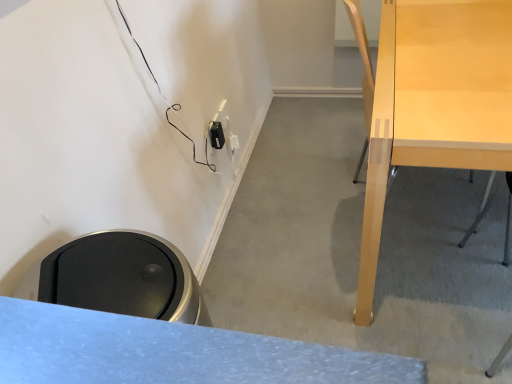
Locate an element on the screen. The width and height of the screenshot is (512, 384). black plastic electric outlet at lower center is located at coordinates (216, 135).

Measure the distance between black plastic electric outlet at lower center and camera.

The distance of black plastic electric outlet at lower center from camera is 5.33 feet.

Describe the element at coordinates (216, 135) in the screenshot. I see `black plastic electric outlet at lower center` at that location.

Image resolution: width=512 pixels, height=384 pixels. What do you see at coordinates (435, 103) in the screenshot? I see `light wood desk at right` at bounding box center [435, 103].

The image size is (512, 384). Find the location of `light wood desk at right`. light wood desk at right is located at coordinates (435, 103).

This screenshot has height=384, width=512. I want to click on black plastic electric outlet at lower center, so click(x=216, y=135).

Is black plastic electric outlet at lower center to the left of light wood desk at right from the viewer's perspective?

Yes.

Does black plastic electric outlet at lower center lie in front of light wood desk at right?

No, black plastic electric outlet at lower center is further to the viewer.

Which point is more distant from viewer, (218, 144) or (424, 57)?

The point (218, 144) is farther from the camera.

From the image's perspective, who appears lower, black plastic electric outlet at lower center or light wood desk at right?

From the image's view, light wood desk at right is below.

From a real-world perspective, who is located higher, black plastic electric outlet at lower center or light wood desk at right?

black plastic electric outlet at lower center.

Which object is wider, black plastic electric outlet at lower center or light wood desk at right?

light wood desk at right.

Which of these two, black plastic electric outlet at lower center or light wood desk at right, stands taller?

Standing taller between the two is light wood desk at right.

Considering the relative sizes of black plastic electric outlet at lower center and light wood desk at right in the image provided, is black plastic electric outlet at lower center smaller than light wood desk at right?

Indeed, black plastic electric outlet at lower center has a smaller size compared to light wood desk at right.

Can we say black plastic electric outlet at lower center lies outside light wood desk at right?

Absolutely, black plastic electric outlet at lower center is external to light wood desk at right.

From the picture: Is black plastic electric outlet at lower center positioned far away from light wood desk at right?

No, there isn't a large distance between black plastic electric outlet at lower center and light wood desk at right.

Is black plastic electric outlet at lower center oriented away from light wood desk at right?

black plastic electric outlet at lower center does not have its back to light wood desk at right.

Can you tell me how much black plastic electric outlet at lower center and light wood desk at right differ in facing direction?

The facing directions of black plastic electric outlet at lower center and light wood desk at right are 87.9 degrees apart.

At what (x,y) coordinates should I click in order to perform the action: click on desk to the right of black plastic electric outlet at lower center. Please return your answer as a coordinate pair (x, y). This screenshot has width=512, height=384. Looking at the image, I should click on (435, 103).

Is light wood desk at right to the right of black plastic electric outlet at lower center from the viewer's perspective?

Indeed, light wood desk at right is positioned on the right side of black plastic electric outlet at lower center.

Is light wood desk at right in front of or behind black plastic electric outlet at lower center in the image?

Visually, light wood desk at right is located in front of black plastic electric outlet at lower center.

Between point (486, 130) and point (217, 128), which one is positioned in front?

Point (486, 130)

From the image's perspective, does light wood desk at right appear lower than black plastic electric outlet at lower center?

Yes, from the image's perspective, light wood desk at right is beneath black plastic electric outlet at lower center.

From a real-world perspective, which is physically below, light wood desk at right or black plastic electric outlet at lower center?

light wood desk at right.

Which object is thinner, light wood desk at right or black plastic electric outlet at lower center?

black plastic electric outlet at lower center is thinner.

In terms of height, does light wood desk at right look taller or shorter compared to black plastic electric outlet at lower center?

Clearly, light wood desk at right is taller compared to black plastic electric outlet at lower center.

Can you confirm if light wood desk at right is bigger than black plastic electric outlet at lower center?

Indeed, light wood desk at right has a larger size compared to black plastic electric outlet at lower center.

Can we say light wood desk at right lies outside black plastic electric outlet at lower center?

Yes.

Is light wood desk at right not near black plastic electric outlet at lower center?

No, light wood desk at right is not far from black plastic electric outlet at lower center.

Is light wood desk at right facing towards black plastic electric outlet at lower center?

No, light wood desk at right is not aimed at black plastic electric outlet at lower center.

Where is `desk that is in front of the black plastic electric outlet at lower center`? The width and height of the screenshot is (512, 384). desk that is in front of the black plastic electric outlet at lower center is located at coordinates (435, 103).

You are a GUI agent. You are given a task and a screenshot of the screen. Output one action in this format:
    pyautogui.click(x=<x>, y=<y>)
    Task: Click on the electric outlet that is above the light wood desk at right (from the image's perspective)
    This screenshot has width=512, height=384.
    Given the screenshot: What is the action you would take?
    pyautogui.click(x=216, y=135)

This screenshot has width=512, height=384. I want to click on desk that is in front of the black plastic electric outlet at lower center, so (x=435, y=103).